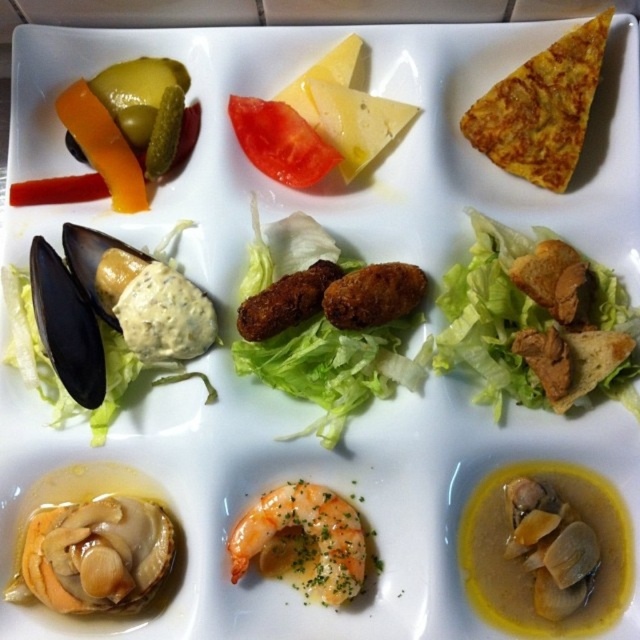
Is golden crispy croquettes at center wider than yellow crispy tortilla at upper right?

Correct, the width of golden crispy croquettes at center exceeds that of yellow crispy tortilla at upper right.

Which of these two, golden crispy croquettes at center or yellow crispy tortilla at upper right, stands shorter?

Standing shorter between the two is yellow crispy tortilla at upper right.

Between point (339, 403) and point (570, 129), which one is positioned behind?

The point (570, 129) is more distant.

Find the location of a particular element. Image resolution: width=640 pixels, height=640 pixels. golden crispy croquettes at center is located at coordinates (332, 369).

Which is more to the right, golden crispy croquettes at center or shiny orange shellfish at bottom left?

golden crispy croquettes at center is more to the right.

Is golden crispy croquettes at center to the right of shiny orange shellfish at bottom left from the viewer's perspective?

Yes, golden crispy croquettes at center is to the right of shiny orange shellfish at bottom left.

Does point (388, 323) come behind point (109, 568)?

Yes, point (388, 323) is behind point (109, 568).

Image resolution: width=640 pixels, height=640 pixels. What are the coordinates of `golden crispy croquettes at center` in the screenshot? It's located at (332, 369).

What do you see at coordinates (97, 554) in the screenshot?
I see `shiny orange shellfish at bottom left` at bounding box center [97, 554].

Where is `shiny orange shellfish at bottom left`? Image resolution: width=640 pixels, height=640 pixels. shiny orange shellfish at bottom left is located at coordinates (97, 554).

Does point (115, 520) come in front of point (576, 49)?

Yes, point (115, 520) is in front of point (576, 49).

This screenshot has height=640, width=640. Identify the location of shiny orange shellfish at bottom left. (97, 554).